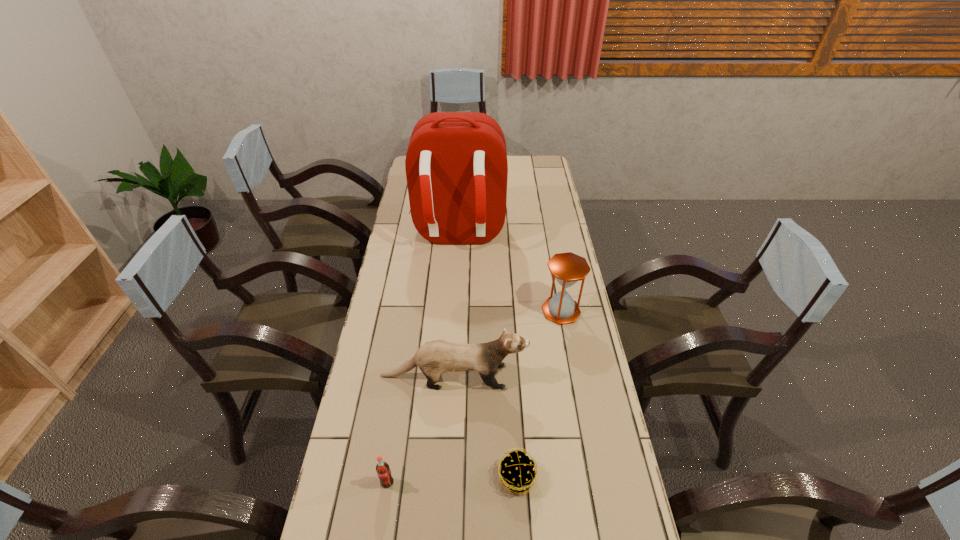
Locate an element on the screen. the farthest object is located at coordinates (456, 165).

This screenshot has width=960, height=540. I want to click on the tallest object, so click(x=456, y=165).

Find the location of a particular element. hourglass is located at coordinates (568, 268).

The width and height of the screenshot is (960, 540). I want to click on the fourth nearest object, so click(568, 268).

Find the location of a particular element. ferret is located at coordinates (434, 358).

Identify the location of soda bottle. (383, 470).

Find the location of a particular element. Image resolution: width=960 pixels, height=540 pixels. the shortest object is located at coordinates (517, 473).

Locate an element on the screen. The image size is (960, 540). blank space located on the strap side of the backpack is located at coordinates (451, 341).

Where is `vacant area situated on the left of the hourglass`? Image resolution: width=960 pixels, height=540 pixels. vacant area situated on the left of the hourglass is located at coordinates (480, 311).

I want to click on vacant region located on the face of the third nearest object, so click(578, 376).